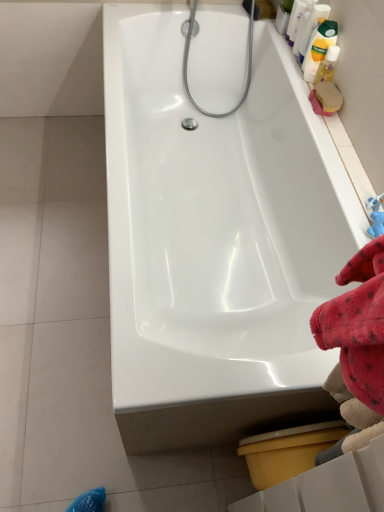
This screenshot has height=512, width=384. In order to click on chrome metallic shower head at upper center in this screenshot , I will do `click(187, 62)`.

At what (x,y) coordinates should I click in order to perform the action: click on translucent plastic bottle at upper right, which is the third cleaning product in bottom-to-top order. Please return your answer as a coordinate pair (x, y). The image size is (384, 512). Looking at the image, I should click on (311, 27).

Image resolution: width=384 pixels, height=512 pixels. Identify the location of chrome metallic shower head at upper center. (187, 62).

How different are the orientations of yellow plastic toilet bowl at lower right and white glossy bathtub at center in degrees?

yellow plastic toilet bowl at lower right and white glossy bathtub at center are facing 1.71 degrees away from each other.

Is yellow plastic toilet bowl at lower right not inside white glossy bathtub at center?

Yes.

From a real-world perspective, between yellow plastic toilet bowl at lower right and white glossy bathtub at center, who is vertically lower?

From a 3D spatial view, yellow plastic toilet bowl at lower right is below.

Would you consider yellow plastic toilet bowl at lower right to be distant from white glossy bathtub at center?

No, yellow plastic toilet bowl at lower right is not far away from white glossy bathtub at center.

Does chrome metallic shower head at upper center have a lesser width compared to translucent plastic bottle at upper right, which is the third cleaning product in bottom-to-top order?

In fact, chrome metallic shower head at upper center might be wider than translucent plastic bottle at upper right, which is the third cleaning product in bottom-to-top order.

Are chrome metallic shower head at upper center and translucent plastic bottle at upper right, placed as the 2th cleaning product when sorted from top to bottom, located far from each other?

No, chrome metallic shower head at upper center is not far away from translucent plastic bottle at upper right, placed as the 2th cleaning product when sorted from top to bottom.

Where is `shower behind the translucent plastic bottle at upper right, which is the third cleaning product in bottom-to-top order`? The width and height of the screenshot is (384, 512). shower behind the translucent plastic bottle at upper right, which is the third cleaning product in bottom-to-top order is located at coordinates (187, 62).

In the scene shown: Which point is more forward, [191,98] or [303,56]?

The point [303,56] is in front.

Would you say yellow matte bottle at upper right, which is the 2th cleaning product in bottom-to-top order, contains yellow matte bottle at upper right, the 4th cleaning product from the top?

No, yellow matte bottle at upper right, the 4th cleaning product from the top, is not inside yellow matte bottle at upper right, which is the 2th cleaning product in bottom-to-top order.

From the image's perspective, between yellow matte bottle at upper right, which is the 2th cleaning product in bottom-to-top order, and yellow matte bottle at upper right, the 4th cleaning product from the top, which one is located above?

yellow matte bottle at upper right, which is the 2th cleaning product in bottom-to-top order, from the image's perspective.

From a real-world perspective, which is physically below, yellow matte bottle at upper right, which is the 3th cleaning product in top-to-bottom order, or yellow matte bottle at upper right, the 4th cleaning product from the top?

In real-world perspective, yellow matte bottle at upper right, the 4th cleaning product from the top, is lower.

Looking at this image, how far apart are yellow matte bottle at upper right, which is the 2th cleaning product in bottom-to-top order, and yellow matte bottle at upper right, the 4th cleaning product from the top?

1.90 inches.

Between translucent plastic bottle at upper right, placed as the 2th cleaning product when sorted from top to bottom, and yellow matte bottle at upper right, which is the 3th cleaning product in top-to-bottom order, which one has larger width?

yellow matte bottle at upper right, which is the 3th cleaning product in top-to-bottom order.

Which is closer, (304,26) or (330,27)?

Clearly, point (304,26) is more distant from the camera than point (330,27).

Is translucent plastic bottle at upper right, placed as the 2th cleaning product when sorted from top to bottom, not close to yellow matte bottle at upper right, which is the 2th cleaning product in bottom-to-top order?

That's not correct — translucent plastic bottle at upper right, placed as the 2th cleaning product when sorted from top to bottom, is a little close to yellow matte bottle at upper right, which is the 2th cleaning product in bottom-to-top order.

Find the location of a particular element. The width and height of the screenshot is (384, 512). the 1st cleaning product counting from the right of the translucent plastic bottle at upper right, which is the third cleaning product in bottom-to-top order is located at coordinates (318, 48).

From a real-world perspective, is white glossy bathtub at center located beneath chrome metallic shower head at upper center?

Yes.

Is white glossy bathtub at center aimed at chrome metallic shower head at upper center?

No, white glossy bathtub at center is not turned towards chrome metallic shower head at upper center.

Is the surface of white glossy bathtub at center in direct contact with chrome metallic shower head at upper center?

There is a gap between white glossy bathtub at center and chrome metallic shower head at upper center.

What are the coordinates of `shower positioned vertically above the white glossy bathtub at center (from a real-world perspective)` in the screenshot? It's located at (187, 62).

Does yellow matte bottle at upper right, which is the 3th cleaning product in top-to-bottom order, have a larger size compared to white glossy bottle at upper right, marked as the 4th cleaning product in a bottom-to-top arrangement?

Yes.

Considering the sizes of objects yellow matte bottle at upper right, which is the 3th cleaning product in top-to-bottom order, and white glossy bottle at upper right, the 1th cleaning product viewed from the top, in the image provided, who is shorter, yellow matte bottle at upper right, which is the 3th cleaning product in top-to-bottom order, or white glossy bottle at upper right, the 1th cleaning product viewed from the top,?

white glossy bottle at upper right, the 1th cleaning product viewed from the top.

Is yellow matte bottle at upper right, which is the 3th cleaning product in top-to-bottom order, beside white glossy bottle at upper right, the 1th cleaning product viewed from the top?

yellow matte bottle at upper right, which is the 3th cleaning product in top-to-bottom order, and white glossy bottle at upper right, the 1th cleaning product viewed from the top, are not in contact.

Is yellow matte bottle at upper right, which is the 2th cleaning product in bottom-to-top order, to the right of white glossy bottle at upper right, marked as the 4th cleaning product in a bottom-to-top arrangement, from the viewer's perspective?

Correct, you'll find yellow matte bottle at upper right, which is the 2th cleaning product in bottom-to-top order, to the right of white glossy bottle at upper right, marked as the 4th cleaning product in a bottom-to-top arrangement.

Is yellow matte bottle at upper right, the 4th cleaning product from the top, in front of white glossy bottle at upper right, the 1th cleaning product viewed from the top?

Yes.

From the image's perspective, is yellow matte bottle at upper right, which is counted as the 1th cleaning product, starting from the bottom, positioned above or below white glossy bottle at upper right, the 1th cleaning product viewed from the top?

yellow matte bottle at upper right, which is counted as the 1th cleaning product, starting from the bottom, is situated lower than white glossy bottle at upper right, the 1th cleaning product viewed from the top, in the image.

Find the location of a particular element. Image resolution: width=384 pixels, height=512 pixels. the 1st cleaning product located above the yellow matte bottle at upper right, the 4th cleaning product from the top (from a real-world perspective) is located at coordinates (297, 18).

Identify the location of bathtub in front of the yellow plastic toilet bowl at lower right. (216, 223).

At what (x,y) coordinates should I click in order to perform the action: click on cleaning product that is the 2nd one when counting rightward from the chrome metallic shower head at upper center. Please return your answer as a coordinate pair (x, y). This screenshot has width=384, height=512. Looking at the image, I should click on (311, 27).

Based on their spatial positions, is white glossy bathtub at center or chrome metallic shower head at upper center closer to yellow matte bottle at upper right, which is the 3th cleaning product in top-to-bottom order?

Among the two, chrome metallic shower head at upper center is located nearer to yellow matte bottle at upper right, which is the 3th cleaning product in top-to-bottom order.

Estimate the real-world distances between objects in this image. Which object is closer to yellow plastic toilet bowl at lower right, white glossy bottle at upper right, marked as the 4th cleaning product in a bottom-to-top arrangement, or yellow matte bottle at upper right, which is the 2th cleaning product in bottom-to-top order?

yellow matte bottle at upper right, which is the 2th cleaning product in bottom-to-top order, lies closer to yellow plastic toilet bowl at lower right than the other object.

When comparing their distances from white glossy bathtub at center, does white glossy bottle at upper right, the 1th cleaning product viewed from the top, or translucent plastic bottle at upper right, placed as the 2th cleaning product when sorted from top to bottom, seem closer?

translucent plastic bottle at upper right, placed as the 2th cleaning product when sorted from top to bottom.

Which object lies nearer to the anchor point yellow matte bottle at upper right, which is counted as the 1th cleaning product, starting from the bottom, translucent plastic bottle at upper right, which is the third cleaning product in bottom-to-top order, or white glossy bathtub at center?

translucent plastic bottle at upper right, which is the third cleaning product in bottom-to-top order.

From the picture: Which object lies nearer to the anchor point white glossy bathtub at center, translucent plastic bottle at upper right, which is the third cleaning product in bottom-to-top order, or yellow matte bottle at upper right, the 4th cleaning product from the top?

translucent plastic bottle at upper right, which is the third cleaning product in bottom-to-top order, lies closer to white glossy bathtub at center than the other object.

Which object lies further to the anchor point translucent plastic bottle at upper right, which is the third cleaning product in bottom-to-top order, yellow matte bottle at upper right, which is counted as the 1th cleaning product, starting from the bottom, or white glossy bathtub at center?

white glossy bathtub at center.

From the image, which object appears to be farther from white glossy bathtub at center, yellow matte bottle at upper right, which is counted as the 1th cleaning product, starting from the bottom, or chrome metallic shower head at upper center?

yellow matte bottle at upper right, which is counted as the 1th cleaning product, starting from the bottom, lies further to white glossy bathtub at center than the other object.

Considering their positions, is white glossy bottle at upper right, the 1th cleaning product viewed from the top, positioned further to yellow matte bottle at upper right, which is counted as the 1th cleaning product, starting from the bottom, than yellow matte bottle at upper right, which is the 3th cleaning product in top-to-bottom order?

white glossy bottle at upper right, the 1th cleaning product viewed from the top, is positioned further to the anchor yellow matte bottle at upper right, which is counted as the 1th cleaning product, starting from the bottom.

Locate an element on the screen. The image size is (384, 512). shower between white glossy bottle at upper right, the 1th cleaning product viewed from the top, and yellow plastic toilet bowl at lower right from top to bottom is located at coordinates (187, 62).

Image resolution: width=384 pixels, height=512 pixels. Find the location of `bathtub between chrome metallic shower head at upper center and yellow plastic toilet bowl at lower right in the up-down direction`. bathtub between chrome metallic shower head at upper center and yellow plastic toilet bowl at lower right in the up-down direction is located at coordinates (216, 223).

You are a GUI agent. You are given a task and a screenshot of the screen. Output one action in this format:
    pyautogui.click(x=<x>, y=<y>)
    Task: Click on the cleaning product between yellow matte bottle at upper right, which is the 3th cleaning product in top-to-bottom order, and yellow plastic toilet bowl at lower right from top to bottom
    The height and width of the screenshot is (512, 384).
    Given the screenshot: What is the action you would take?
    pyautogui.click(x=327, y=65)

You are a GUI agent. You are given a task and a screenshot of the screen. Output one action in this format:
    pyautogui.click(x=<x>, y=<y>)
    Task: Click on the cleaning product between white glossy bottle at upper right, the 1th cleaning product viewed from the top, and yellow matte bottle at upper right, which is the 2th cleaning product in bottom-to-top order, in the up-down direction
    This screenshot has width=384, height=512.
    Given the screenshot: What is the action you would take?
    pyautogui.click(x=311, y=27)